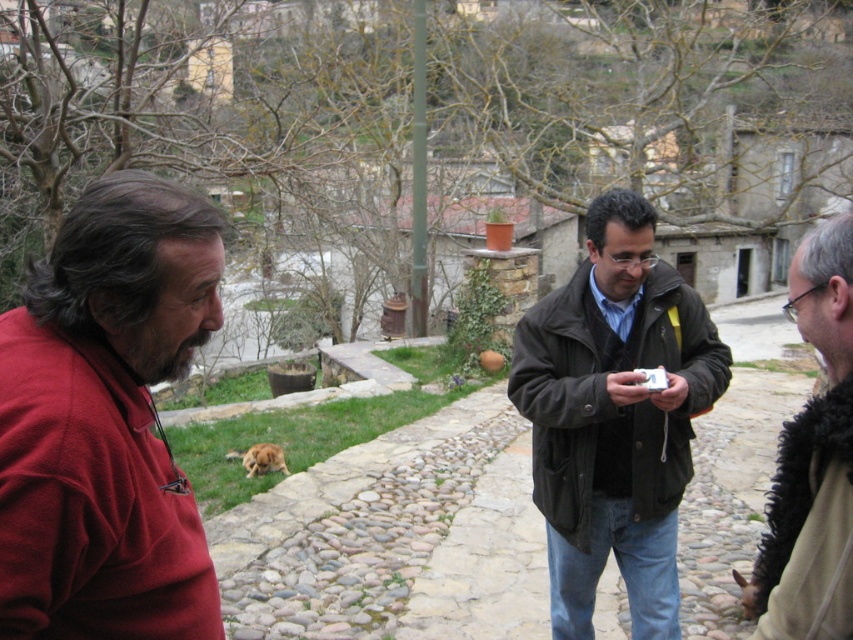
This screenshot has width=853, height=640. Describe the element at coordinates (106, 422) in the screenshot. I see `matte red shirt at left` at that location.

Based on the photo, does matte red shirt at left have a larger size compared to dark brown leather jacket at center?

No.

You are a GUI agent. You are given a task and a screenshot of the screen. Output one action in this format:
    pyautogui.click(x=<x>, y=<y>)
    Task: Click on the matte red shirt at left
    
    Given the screenshot: What is the action you would take?
    pyautogui.click(x=106, y=422)

Image resolution: width=853 pixels, height=640 pixels. In order to click on matte red shirt at left in this screenshot , I will do `click(106, 422)`.

Can you confirm if dark brown leather jacket at center is taller than black fuzzy scarf at right?

Yes.

Is dark brown leather jacket at center further to the viewer compared to black fuzzy scarf at right?

Yes, dark brown leather jacket at center is behind black fuzzy scarf at right.

Does point (601, 426) lie behind point (839, 476)?

Yes.

The height and width of the screenshot is (640, 853). Identify the location of dark brown leather jacket at center. (614, 417).

Is matte red shirt at left positioned in front of black fuzzy scarf at right?

That is True.

Is point (47, 508) behind point (819, 298)?

That is False.

I want to click on matte red shirt at left, so click(x=106, y=422).